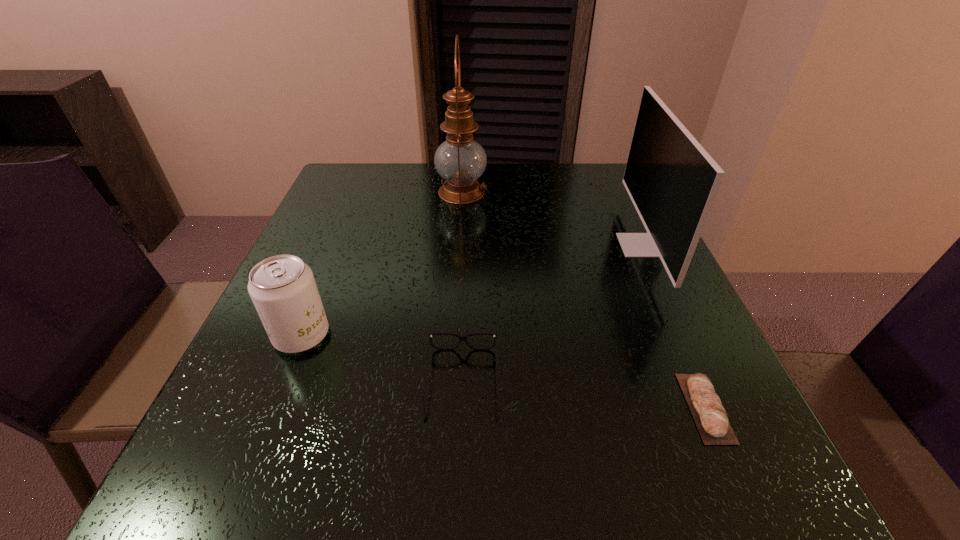
In order to click on vacant region at the near edge of the desktop in this screenshot , I will do `click(602, 514)`.

At what (x,y) coordinates should I click in order to perform the action: click on vacant position at the left edge of the desktop. Please return your answer as a coordinate pair (x, y). This screenshot has height=540, width=960. Looking at the image, I should click on [322, 345].

In the image, there is a desktop. Where is `free space at the right edge`? free space at the right edge is located at coordinates (618, 293).

In order to click on free space at the near left corner in this screenshot , I will do `click(269, 464)`.

This screenshot has width=960, height=540. I want to click on blank space at the far right corner of the desktop, so click(x=575, y=192).

Image resolution: width=960 pixels, height=540 pixels. Identify the location of vacant area at the near right corner. click(685, 503).

This screenshot has width=960, height=540. I want to click on free space between the tallest object and the monitor, so click(x=551, y=219).

The width and height of the screenshot is (960, 540). I want to click on free space between the tallest object and the monitor, so click(x=551, y=219).

Find the location of a particular element. The image size is (960, 540). free spot between the leftmost object and the oil lamp is located at coordinates pyautogui.click(x=382, y=264).

Where is `free spot between the pita bread and the spectacles`? The width and height of the screenshot is (960, 540). free spot between the pita bread and the spectacles is located at coordinates (584, 395).